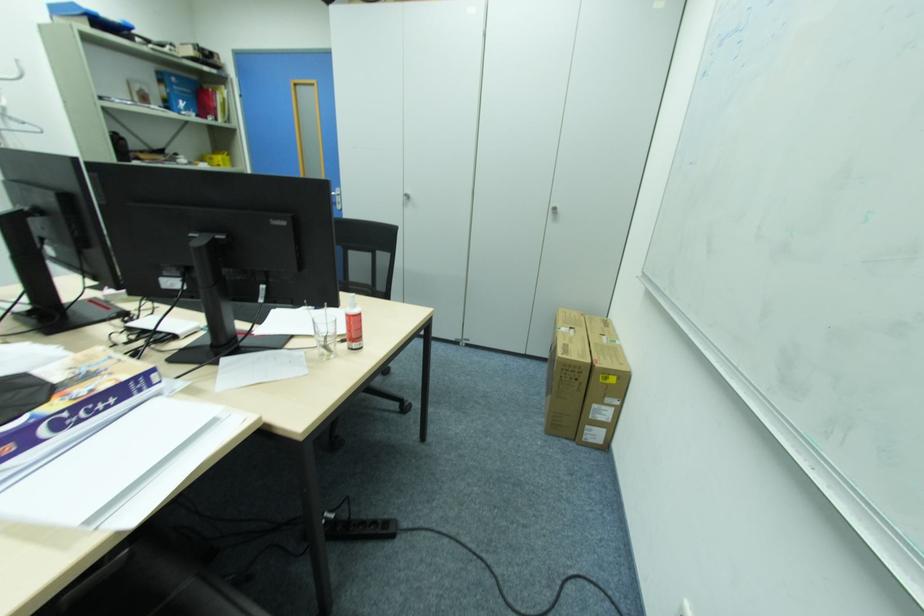
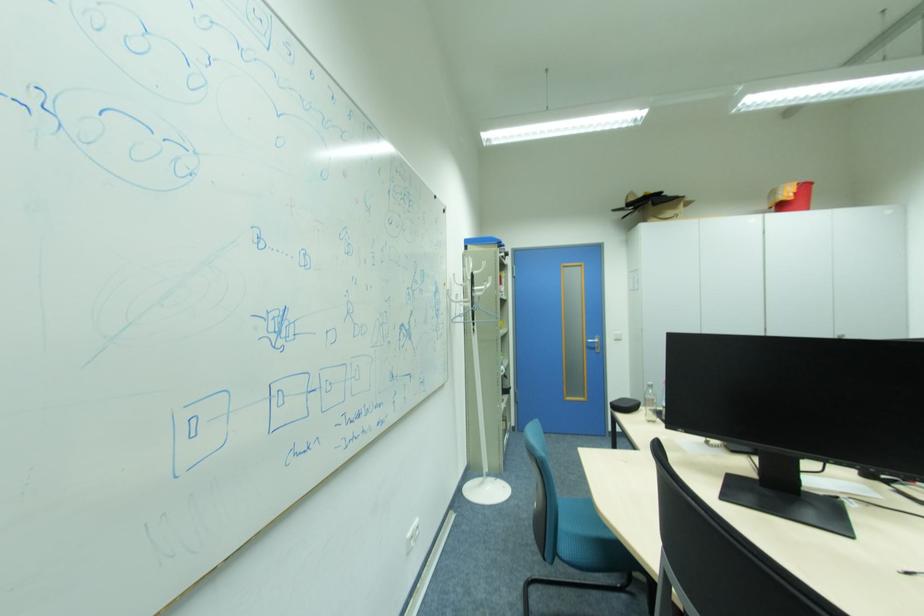
Question: What movement of the cameraman would produce the second image?

Choices:
 (A) Left
 (B) Right
 (C) Forward
 (D) Backward

Answer: (A)